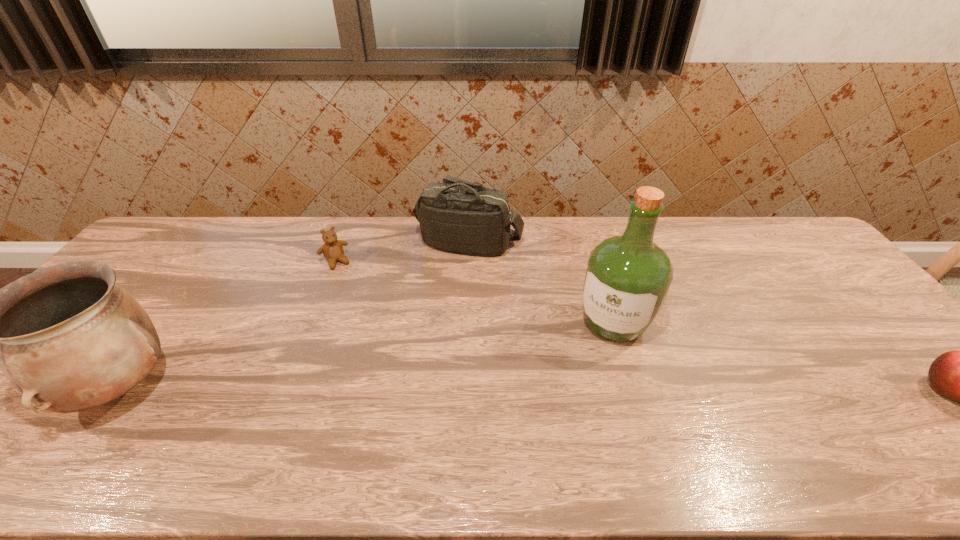
Locate an element on the screen. free space on the desktop that is between the leftmost object and the rightmost object and is positioned on the front-facing side of the teddy bear is located at coordinates (413, 389).

At what (x,y) coordinates should I click in order to perform the action: click on free spot on the desktop that is between the urn and the rightmost object and is positioned at the front padded panel of the shoulder bag. Please return your answer as a coordinate pair (x, y). This screenshot has height=540, width=960. Looking at the image, I should click on click(470, 389).

You are a GUI agent. You are given a task and a screenshot of the screen. Output one action in this format:
    pyautogui.click(x=<x>, y=<y>)
    Task: Click on the vacant spot on the desktop that is between the urn and the rightmost object and is positioned on the front-facing side of the second object from right to left
    The width and height of the screenshot is (960, 540).
    Given the screenshot: What is the action you would take?
    pyautogui.click(x=580, y=389)